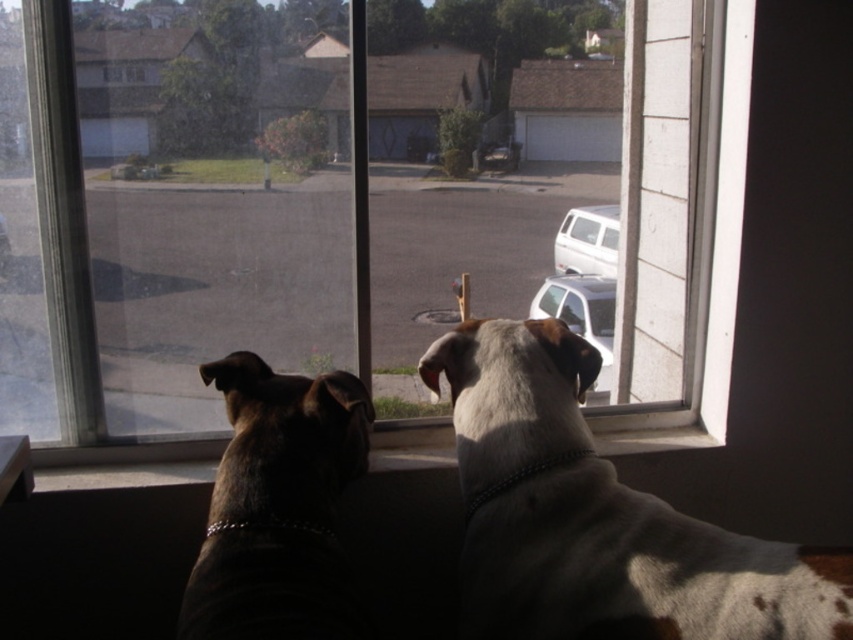
You are a delivery person trying to see the address number on the white matte van at center through the transparent glass window at center. Can you see the entire van through the window?

The transparent glass window at center has a smaller size compared to white matte van at center, so you cannot see the entire van through the window.

You are a delivery person with a package that requires a 1.5 meter wide path to maneuver. You see the transparent glass window at center and the white matte van at center. Is there enough space between them for your delivery vehicle?

The distance between the transparent glass window at center and the white matte van at center is 1.70 meters, which is wider than the required 1.5 meters. Therefore, the delivery vehicle can maneuver through the space between them.